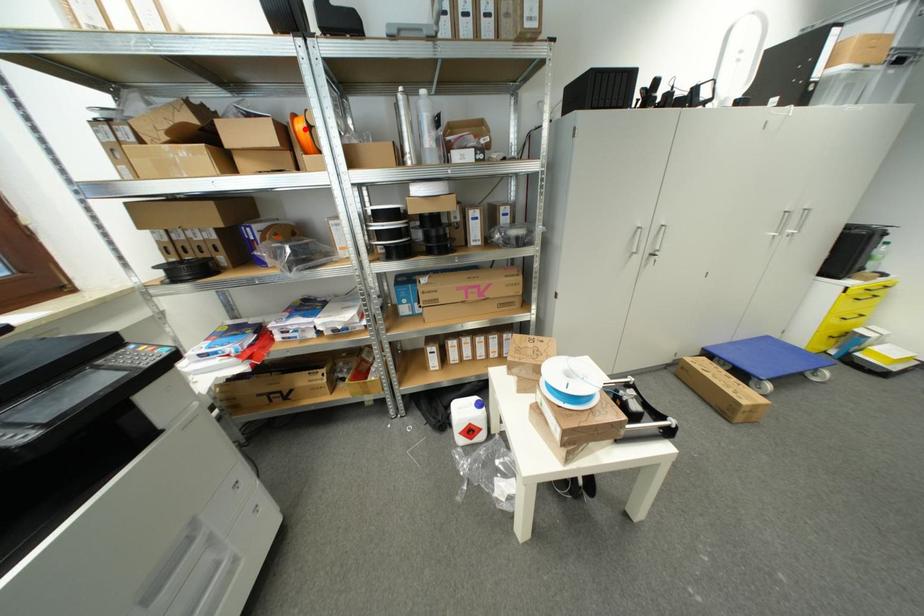
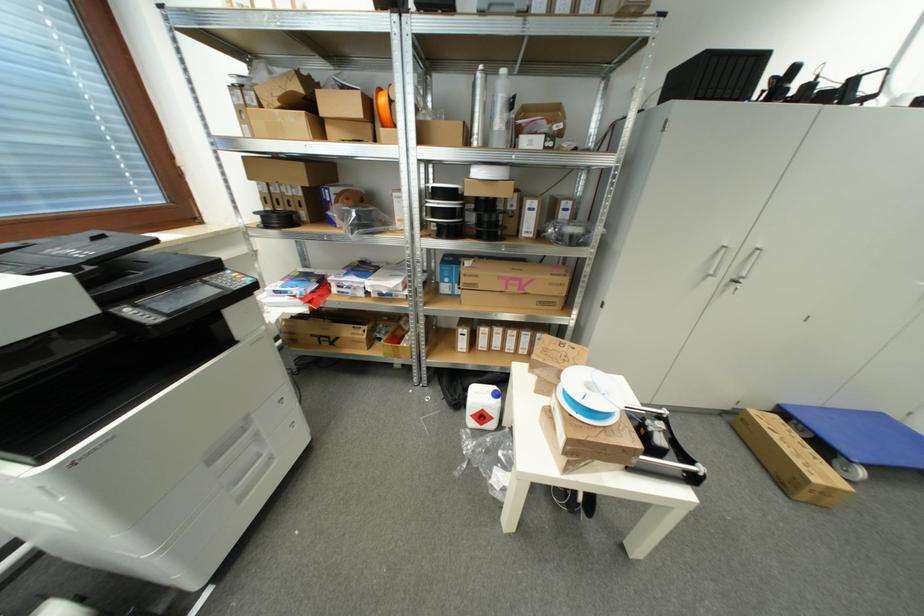
The point at the highlighted location is marked in the first image. Where is the corresponding point in the second image?

(387, 103)